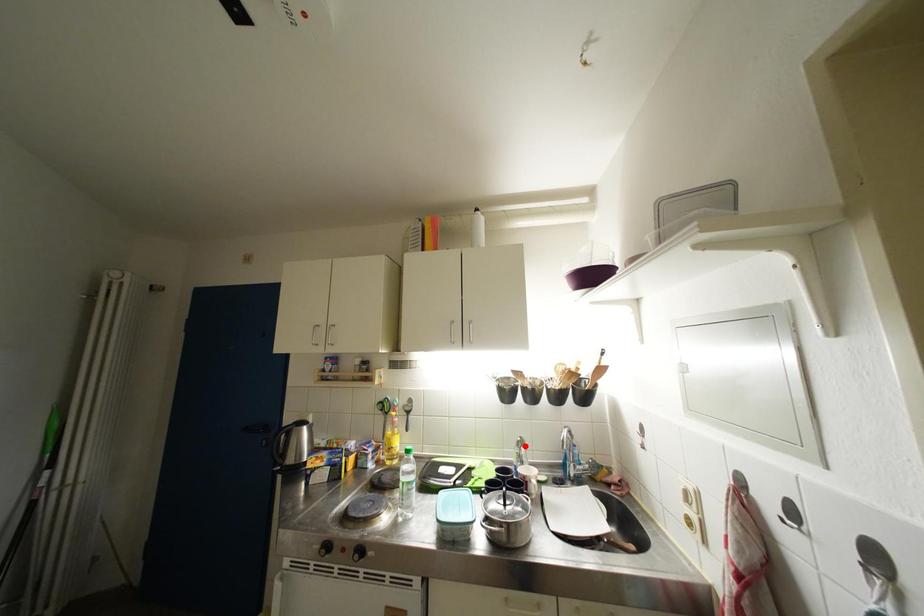
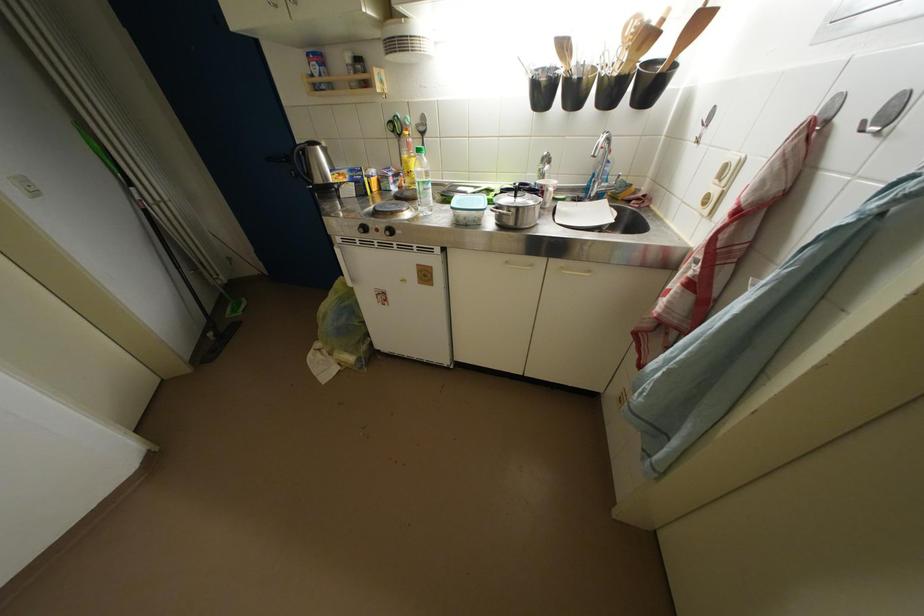
Where in the second image is the point corresponding to the highlighted location from the first image?

(551, 161)